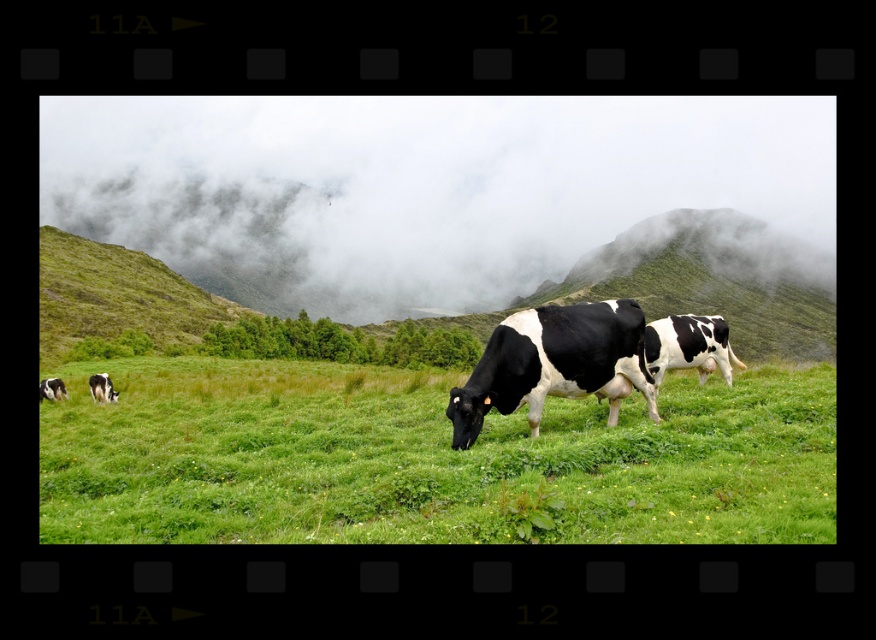
Question: Which of the following is the farthest from the observer?

Choices:
 (A) (309, 193)
 (B) (104, 445)

Answer: (A)

Question: Is green grassy pasture at center positioned behind black and white spotted cow at center?

Choices:
 (A) yes
 (B) no

Answer: (B)

Question: Among these objects, which one is nearest to the camera?

Choices:
 (A) black and white spotted cow at center
 (B) foggy misty clouds at upper center
 (C) green grassy pasture at center

Answer: (C)

Question: Which point appears closest to the camera in this image?

Choices:
 (A) (545, 381)
 (B) (831, 422)

Answer: (B)

Question: Where is foggy misty clouds at upper center located in relation to green grassy pasture at center in the image?

Choices:
 (A) left
 (B) right

Answer: (B)

Question: Is foggy misty clouds at upper center to the right of green grassy pasture at center from the viewer's perspective?

Choices:
 (A) no
 (B) yes

Answer: (B)